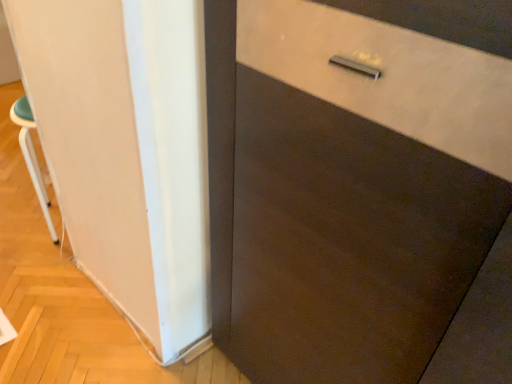
The image size is (512, 384). What are the coordinates of `vacant space situated on the left part of white plastic stool at left` in the screenshot? It's located at (19, 220).